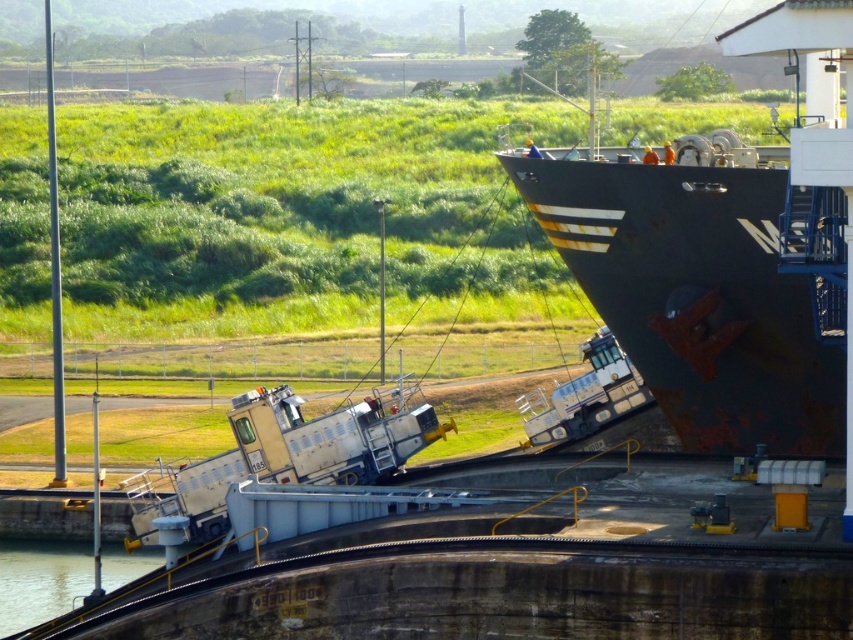
Does rusty metal ship at right appear on the left side of clear water at bottom left?

No, rusty metal ship at right is not to the left of clear water at bottom left.

Between point (636, 170) and point (22, 621), which one is positioned behind?

Positioned behind is point (22, 621).

In order to click on rusty metal ship at right in this screenshot , I will do `click(711, 282)`.